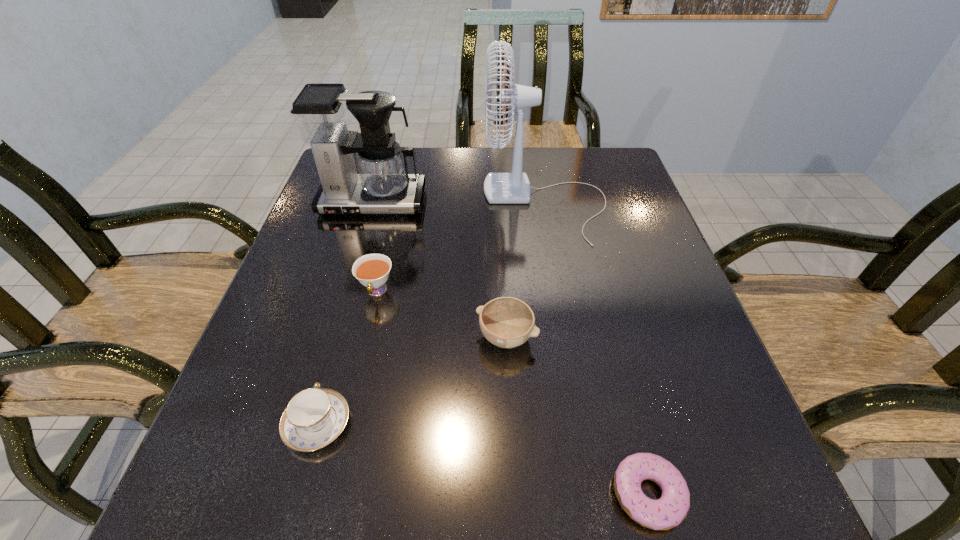
Find the location of `fan`. fan is located at coordinates (513, 187).

This screenshot has height=540, width=960. Identify the location of the fifth shortest object. (322, 113).

Where is `the taller teacup`? the taller teacup is located at coordinates (372, 270).

This screenshot has width=960, height=540. Find the location of `the farther teacup`. the farther teacup is located at coordinates (372, 270).

This screenshot has width=960, height=540. I want to click on the third nearest object, so click(x=507, y=322).

Where is `the nearer teacup`? The image size is (960, 540). the nearer teacup is located at coordinates (315, 417).

This screenshot has height=540, width=960. Identify the location of the shorter teacup. (315, 417).

At what (x,y) coordinates should I click in order to perform the action: click on the nearest object. Please return your answer as a coordinate pair (x, y). This screenshot has height=540, width=960. Looking at the image, I should click on (671, 509).

You are a GUI agent. You are given a task and a screenshot of the screen. Output one action in this format:
    pyautogui.click(x=<x>, y=<y>)
    Task: Click on the doughnut
    
    Given the screenshot: What is the action you would take?
    pyautogui.click(x=671, y=509)

Where is `vacant point located on the front-facing side of the fan`? The height and width of the screenshot is (540, 960). vacant point located on the front-facing side of the fan is located at coordinates (425, 204).